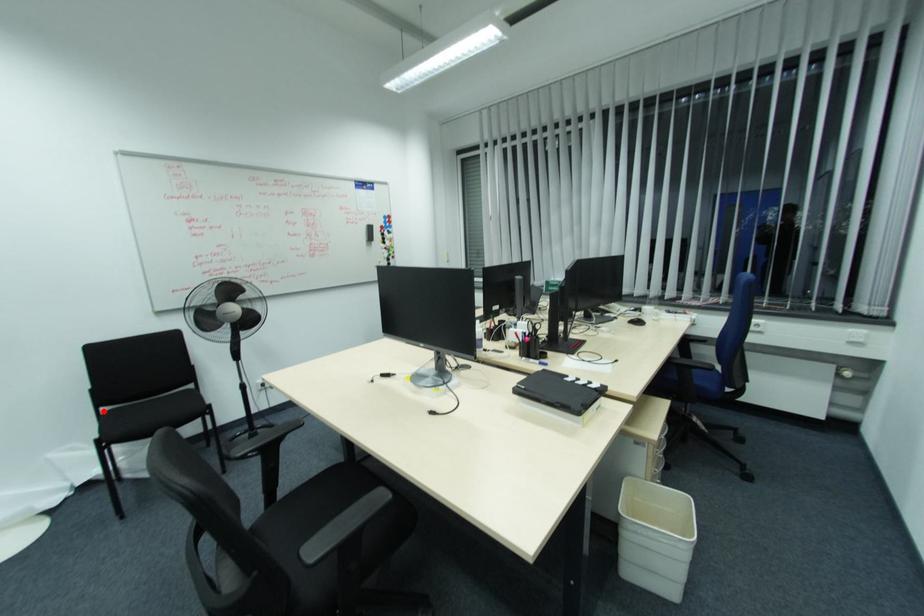
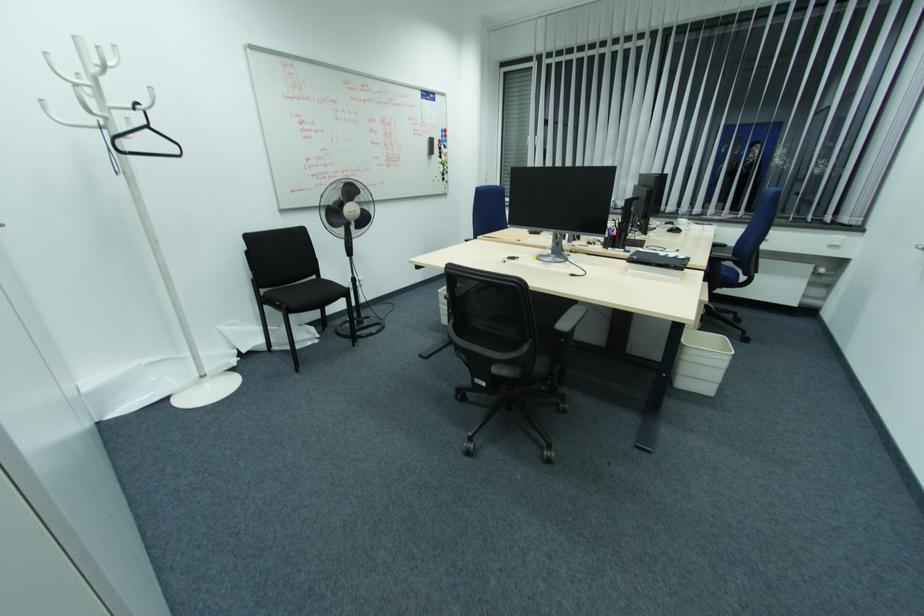
The point at the highlighted location is marked in the first image. Where is the corresponding point in the second image?

(262, 291)